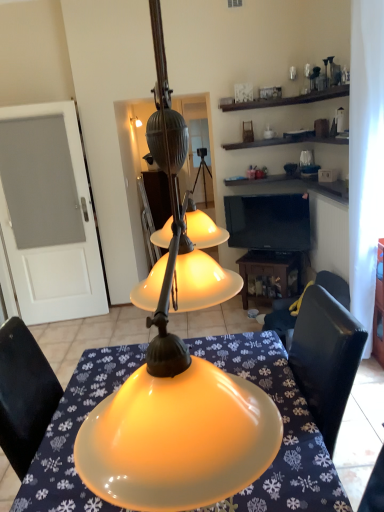
Measure the distance between white frosted glass door at left and camera.

white frosted glass door at left is 3.65 meters away from camera.

What do you see at coordinates (268, 222) in the screenshot? I see `black glossy tv at upper right` at bounding box center [268, 222].

Locate an element on the screen. This screenshot has width=384, height=512. wooden table at lower center is located at coordinates (268, 269).

I want to click on matte yellow lampshade at center, so click(284, 428).

Which of these two, black leather chair at lower right or black glossy tv at upper right, is smaller?

black glossy tv at upper right is smaller.

Does point (333, 278) appear closer or farther from the camera than point (253, 198)?

Point (333, 278) appears to be closer to the viewer than point (253, 198).

Is black leather chair at lower right wider or thinner than black glossy tv at upper right?

In the image, black leather chair at lower right appears to be wider than black glossy tv at upper right.

Identify the location of chair below the black glossy tv at upper right (from a real-world perspective). (280, 318).

Can you confirm if black glossy tv at upper right is bigger than wooden table at lower center?

Incorrect, black glossy tv at upper right is not larger than wooden table at lower center.

Can you confirm if black glossy tv at upper right is positioned to the right of wooden table at lower center?

No.

Can wooden table at lower center be found inside black glossy tv at upper right?

No.

Is point (251, 226) behind point (270, 258)?

Yes.

Is matte yellow lampshade at center oriented towards black glossy tv at upper right?

Yes, matte yellow lampshade at center is aimed at black glossy tv at upper right.

Can you confirm if matte yellow lampshade at center is bigger than black glossy tv at upper right?

Correct, matte yellow lampshade at center is larger in size than black glossy tv at upper right.

Considering the relative sizes of matte yellow lampshade at center and black glossy tv at upper right in the image provided, is matte yellow lampshade at center wider than black glossy tv at upper right?

Yes.

Is matte yellow glass lampshade at center looking in the opposite direction of wooden table at lower center?

No, wooden table at lower center is not at the back of matte yellow glass lampshade at center.

Is point (167, 372) positioned in front of point (271, 266)?

Yes, it is.

Considering the relative sizes of matte yellow glass lampshade at center and wooden table at lower center in the image provided, is matte yellow glass lampshade at center taller than wooden table at lower center?

Indeed, matte yellow glass lampshade at center has a greater height compared to wooden table at lower center.

Which object is further away from the camera, matte yellow glass lampshade at center or wooden table at lower center?

wooden table at lower center is more distant.

Is white frosted glass door at left at the right side of white sheer curtain at right?

No.

Based on the photo, is white frosted glass door at left smaller than white sheer curtain at right?

Actually, white frosted glass door at left might be larger than white sheer curtain at right.

What's the angular difference between white frosted glass door at left and white sheer curtain at right's facing directions?

white frosted glass door at left and white sheer curtain at right are facing 93.8 degrees away from each other.

Considering the points (31, 228) and (373, 52), which point is behind, point (31, 228) or point (373, 52)?

Point (31, 228)

Looking at this image, from a real-world perspective, who is located higher, black glossy tv at upper right or matte yellow glass lampshade at center?

matte yellow glass lampshade at center is physically above.

Can you confirm if black glossy tv at upper right is shorter than matte yellow glass lampshade at center?

Indeed, black glossy tv at upper right has a lesser height compared to matte yellow glass lampshade at center.

Considering the relative positions of black glossy tv at upper right and matte yellow glass lampshade at center in the image provided, is black glossy tv at upper right to the left of matte yellow glass lampshade at center from the viewer's perspective?

No.

Where is `lamp above the black glossy tv at upper right (from the image's perspective)`? lamp above the black glossy tv at upper right (from the image's perspective) is located at coordinates (175, 387).

Is matte yellow glass lampshade at center positioned behind white sheer curtain at right?

No.

Can you confirm if matte yellow glass lampshade at center is wider than white sheer curtain at right?

Correct, the width of matte yellow glass lampshade at center exceeds that of white sheer curtain at right.

Is matte yellow glass lampshade at center taller or shorter than white sheer curtain at right?

In the image, matte yellow glass lampshade at center appears to be shorter than white sheer curtain at right.

In the image, is matte yellow glass lampshade at center on the left side or the right side of white sheer curtain at right?

In the image, matte yellow glass lampshade at center appears on the left side of white sheer curtain at right.

I want to click on chair below the black glossy tv at upper right (from a real-world perspective), so click(x=280, y=318).

Where is `television on the left of wooden table at lower center`? Image resolution: width=384 pixels, height=512 pixels. television on the left of wooden table at lower center is located at coordinates (268, 222).

Estimate the real-world distances between objects in this image. Which object is closer to black leather chair at lower right, wooden table at lower center or matte yellow lampshade at center?

Among the two, wooden table at lower center is located nearer to black leather chair at lower right.

Looking at the image, which one is located closer to wooden table at lower center, white sheer curtain at right or matte yellow lampshade at center?

The object closer to wooden table at lower center is white sheer curtain at right.

From the image, which object appears to be farther from black glossy tv at upper right, matte yellow glass lampshade at center or white frosted glass door at left?

matte yellow glass lampshade at center.

Looking at the image, which one is located closer to matte yellow glass lampshade at center, matte yellow lampshade at center or white sheer curtain at right?

Among the two, matte yellow lampshade at center is located nearer to matte yellow glass lampshade at center.

From the image, which object appears to be farther from white sheer curtain at right, matte yellow lampshade at center or wooden table at lower center?

Among the two, matte yellow lampshade at center is located further to white sheer curtain at right.

When comparing their distances from matte yellow glass lampshade at center, does black leather chair at lower right or matte yellow lampshade at center seem closer?

matte yellow lampshade at center is closer to matte yellow glass lampshade at center.

Estimate the real-world distances between objects in this image. Which object is further from wooden table at lower center, matte yellow glass lampshade at center or black glossy tv at upper right?

matte yellow glass lampshade at center lies further to wooden table at lower center than the other object.

Which object lies further to the anchor point black leather chair at lower right, white sheer curtain at right or white frosted glass door at left?

Among the two, white frosted glass door at left is located further to black leather chair at lower right.

This screenshot has height=512, width=384. In order to click on glass door located between matte yellow lampshade at center and wooden table at lower center in the depth direction in this screenshot , I will do `click(49, 215)`.

Where is `television between matte yellow glass lampshade at center and wooden table at lower center in the front-back direction`? The height and width of the screenshot is (512, 384). television between matte yellow glass lampshade at center and wooden table at lower center in the front-back direction is located at coordinates (268, 222).

Where is `curtain between matte yellow glass lampshade at center and white frosted glass door at left along the z-axis`? This screenshot has height=512, width=384. curtain between matte yellow glass lampshade at center and white frosted glass door at left along the z-axis is located at coordinates (366, 157).

The height and width of the screenshot is (512, 384). Identify the location of desk positioned between matte yellow glass lampshade at center and black leather chair at lower right from near to far. click(x=284, y=428).